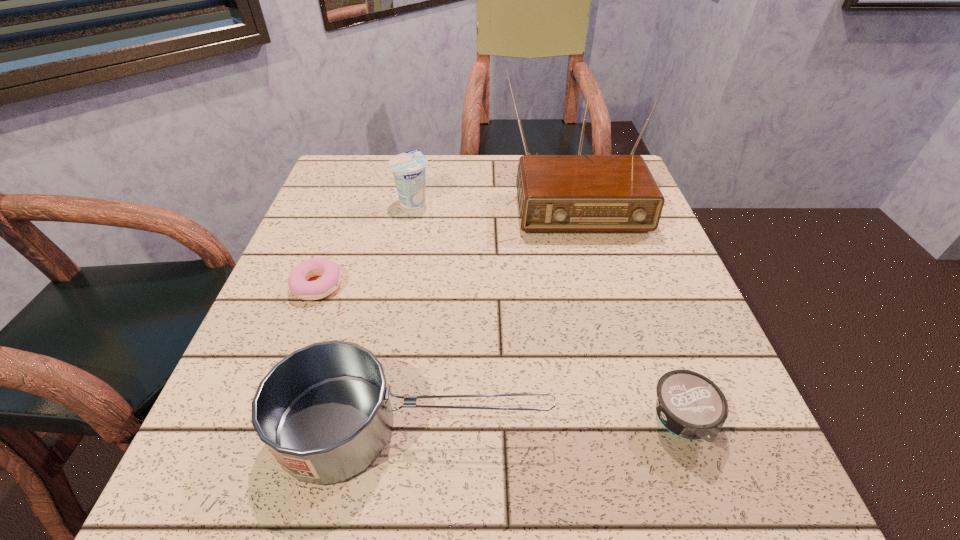
Identify the location of free space located with the handle extending from one side of the saucepan. Image resolution: width=960 pixels, height=540 pixels. (715, 428).

Where is `vacant region located 0.070m on the left of the nearer yogurt`? Image resolution: width=960 pixels, height=540 pixels. vacant region located 0.070m on the left of the nearer yogurt is located at coordinates (603, 423).

You are a GUI agent. You are given a task and a screenshot of the screen. Output one action in this format:
    pyautogui.click(x=<x>, y=<y>)
    Task: Click on the free spot located on the front of the shortest object
    This screenshot has width=960, height=540.
    Given the screenshot: What is the action you would take?
    pyautogui.click(x=257, y=446)

Find the location of a particular element. radio_receiver that is at the far edge is located at coordinates (556, 193).

Locate an element on the screen. yogurt at the far edge is located at coordinates (408, 168).

Locate an element on the screen. This screenshot has width=960, height=540. saucepan at the near edge is located at coordinates (324, 412).

Where is `yogurt that is positioned at the near edge`? This screenshot has height=540, width=960. yogurt that is positioned at the near edge is located at coordinates (689, 405).

Locate an element on the screen. The image size is (960, 540). saucepan at the left edge is located at coordinates (324, 412).

Locate an element on the screen. pastry that is at the left edge is located at coordinates (329, 271).

You are a GUI agent. You are given a task and a screenshot of the screen. Output one action in this format:
    pyautogui.click(x=<x>, y=<y>)
    Task: Click on the radio_receiver that is at the right edge
    This screenshot has height=540, width=960.
    Given the screenshot: What is the action you would take?
    pyautogui.click(x=556, y=193)